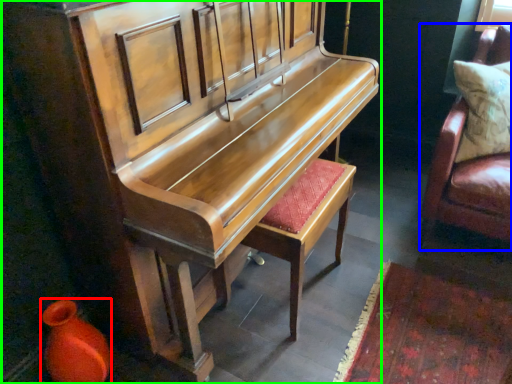
Question: Which object is the farthest from vase (highlighted by a red box)? Choose among these: furniture (highlighted by a blue box) or furniture (highlighted by a green box).

Choices:
 (A) furniture
 (B) furniture

Answer: (A)